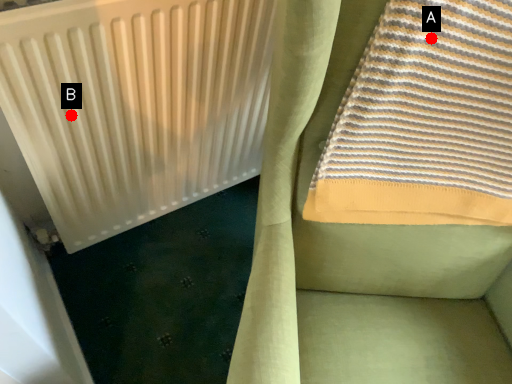
Question: Two points are circled on the image, labeled by A and B beside each circle. Which point is closer to the camera?

Choices:
 (A) A is closer
 (B) B is closer

Answer: (A)